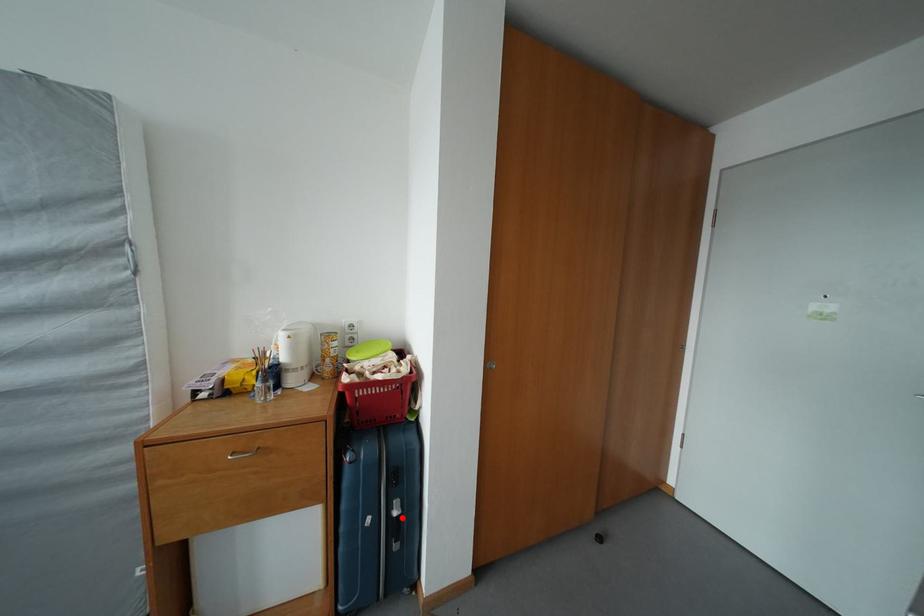
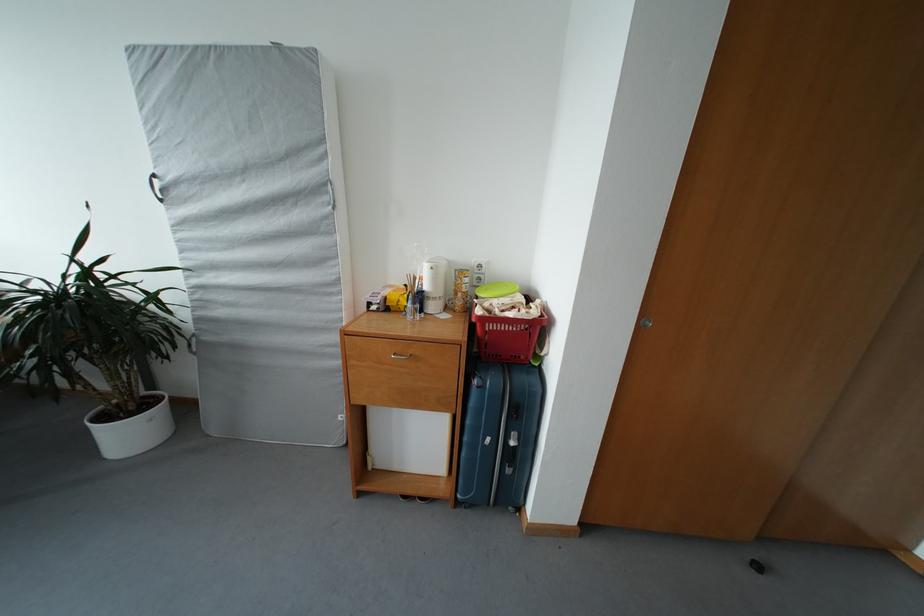
Question: I am providing you with two images of the same scene from different viewpoints. Image1 has a red point marked. In image2, the corresponding 3D location appears at what relative position? Reply with the corresponding letter.

Choices:
 (A) Closer
 (B) Farther

Answer: (A)